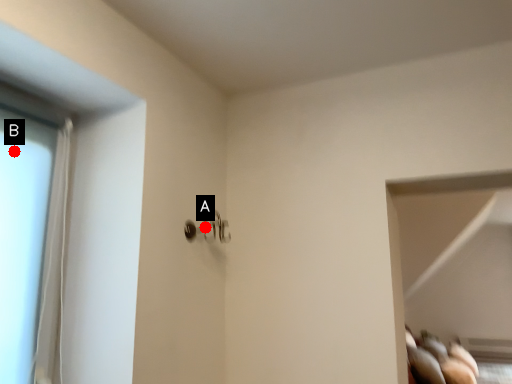
Question: Two points are circled on the image, labeled by A and B beside each circle. Which point appears closest to the camera in this image?

Choices:
 (A) A is closer
 (B) B is closer

Answer: (B)